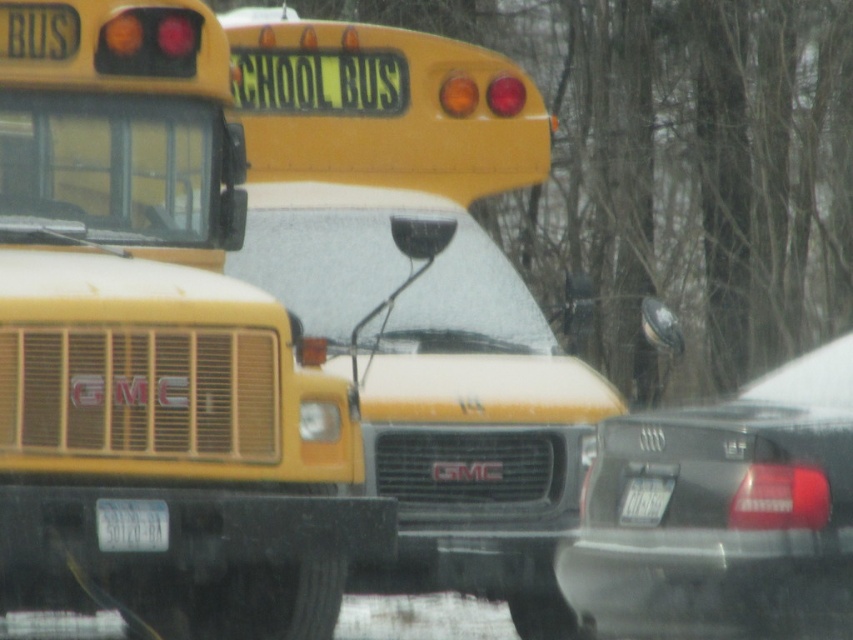
You are a driver trying to read license plates in the scene. Which license plate, the white plastic license plate at lower center or the white plastic license plate at center, is positioned closer to your viewpoint?

The white plastic license plate at lower center is closer to the viewer than the white plastic license plate at center.

You are a photographer trying to capture a clear shot of the yellow matte school bus at center and the white plastic license plate at lower center. Which object will appear larger in your photo?

The yellow matte school bus at center will appear larger in the photo because it is much taller than the white plastic license plate at lower center.

You are a driver trying to navigate through traffic and see the matte black sedan at right. Based on its coordinates, can you estimate its location relative to the center of the image?

The matte black sedan at right is located at coordinates point (726, 515), which places it closer to the bottom right corner of the image compared to the center.